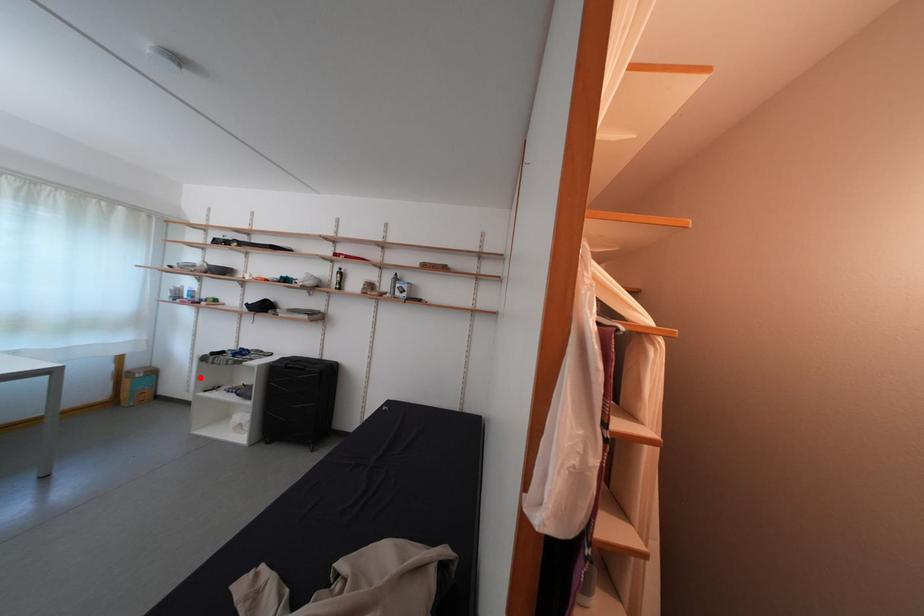
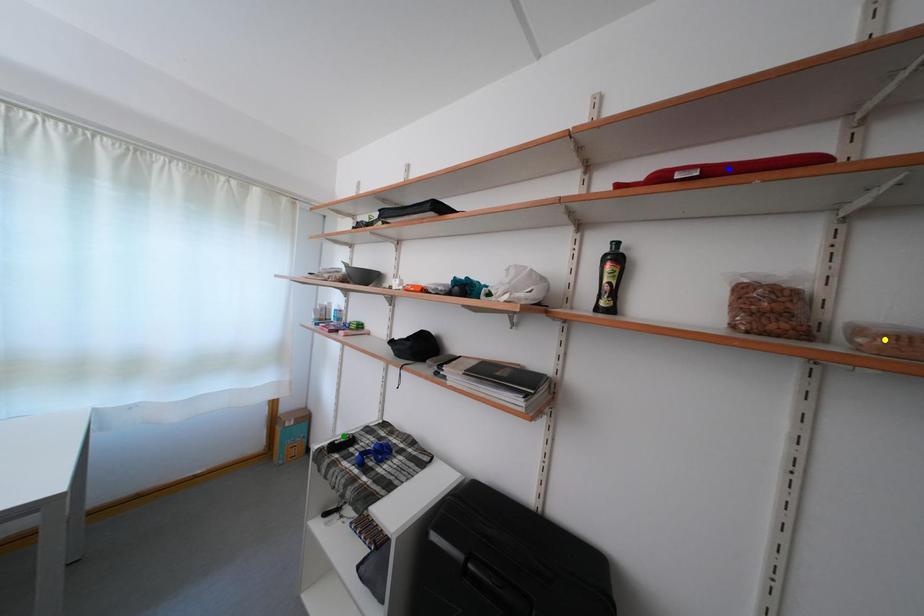
Question: I am providing you with two images of the same scene from different viewpoints. A red point is marked on the first image. You are given multiple points on the second image. Which mark in image 2 goes with the point in image 1?

Choices:
 (A) blue point
 (B) yellow point
 (C) green point

Answer: (C)